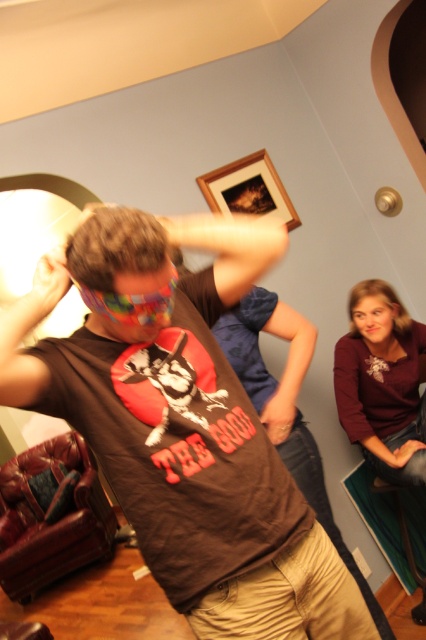
In the scene shown: You are standing in the room and see two points marked in the image. The first point is at coordinate point (141, 369) and the second is at point (365, 419). Which point is closer to you?

Point (141, 369) is in front of point (365, 419), so it is closer to you.

In the image, there is a person wearing a brown Tshirt with a graphic design of a dog and the text THE GOOD in bold red letters. There is also a maroon fabric shirt at upper right. Based on their positions, which clothing item is closer to the top edge of the image?

The maroon fabric shirt at upper right is closer to the top edge of the image because its position at point 0.899 on the y axis is higher than the brown Tshirt with a graphic design of a dog and the text THE GOOD in bold red letters.